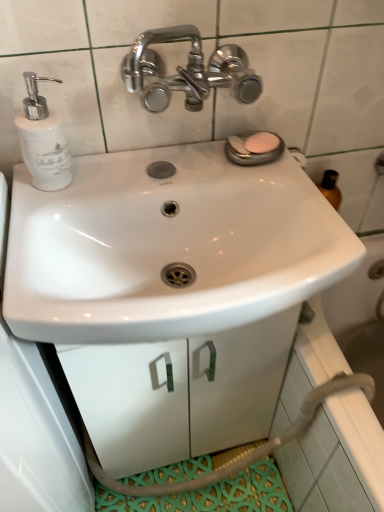
The height and width of the screenshot is (512, 384). In order to click on vacant space that is in between white glossy soap dispenser at left and pink matte soap at upper right in this screenshot , I will do `click(153, 165)`.